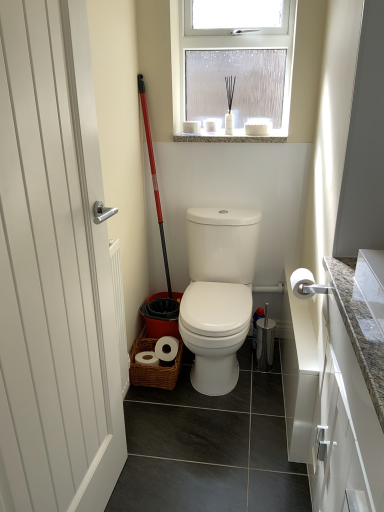
Question: Does white glossy toilet at center have a greater width compared to clear frosted glass at upper center?

Choices:
 (A) no
 (B) yes

Answer: (B)

Question: Can clear frosted glass at upper center be found inside white glossy toilet at center?

Choices:
 (A) yes
 (B) no

Answer: (B)

Question: From the image's perspective, would you say white glossy toilet at center is shown under clear frosted glass at upper center?

Choices:
 (A) yes
 (B) no

Answer: (A)

Question: Does white glossy toilet at center have a larger size compared to clear frosted glass at upper center?

Choices:
 (A) yes
 (B) no

Answer: (A)

Question: Is white glossy toilet at center at the left side of clear frosted glass at upper center?

Choices:
 (A) no
 (B) yes

Answer: (B)

Question: From a real-world perspective, is clear frosted glass at upper center above or below red plastic shovel at center?

Choices:
 (A) below
 (B) above

Answer: (B)

Question: Is point (283, 133) closer or farther from the camera than point (170, 282)?

Choices:
 (A) farther
 (B) closer

Answer: (B)

Question: In the image, is clear frosted glass at upper center positioned in front of or behind red plastic shovel at center?

Choices:
 (A) front
 (B) behind

Answer: (B)

Question: Based on their positions, is clear frosted glass at upper center located to the left or right of red plastic shovel at center?

Choices:
 (A) right
 (B) left

Answer: (A)

Question: Is granite at upper center taller or shorter than clear frosted glass at upper center?

Choices:
 (A) tall
 (B) short

Answer: (B)

Question: Is granite at upper center spatially inside clear frosted glass at upper center, or outside of it?

Choices:
 (A) outside
 (B) inside

Answer: (A)

Question: Visually, is granite at upper center positioned to the left or to the right of clear frosted glass at upper center?

Choices:
 (A) left
 (B) right

Answer: (A)

Question: Is granite at upper center bigger or smaller than clear frosted glass at upper center?

Choices:
 (A) small
 (B) big

Answer: (A)

Question: In the image, is red plastic shovel at center positioned in front of or behind white glossy toilet at center?

Choices:
 (A) front
 (B) behind

Answer: (B)

Question: From their relative heights in the image, would you say red plastic shovel at center is taller or shorter than white glossy toilet at center?

Choices:
 (A) short
 (B) tall

Answer: (B)